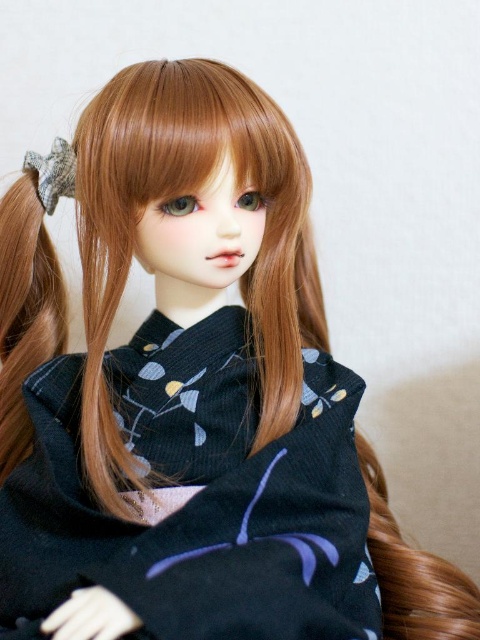
You are an artist trying to sketch the doll. When drawing the hair, which one should you draw first between the light brown silky hair at left and the brown silky hair at lower right?

The light brown silky hair at left should be drawn first because the brown silky hair at lower right is behind it, so you need to draw the foreground hair first before the background one.

From the picture: You are standing in front of the doll and see two points marked on the image. The first point is at coordinates point (x=248, y=531) and the second point is at point (x=72, y=154). Which point is closer to you from your current position?

Point (x=248, y=531) is in front of point (x=72, y=154), so the first point is closer to you.